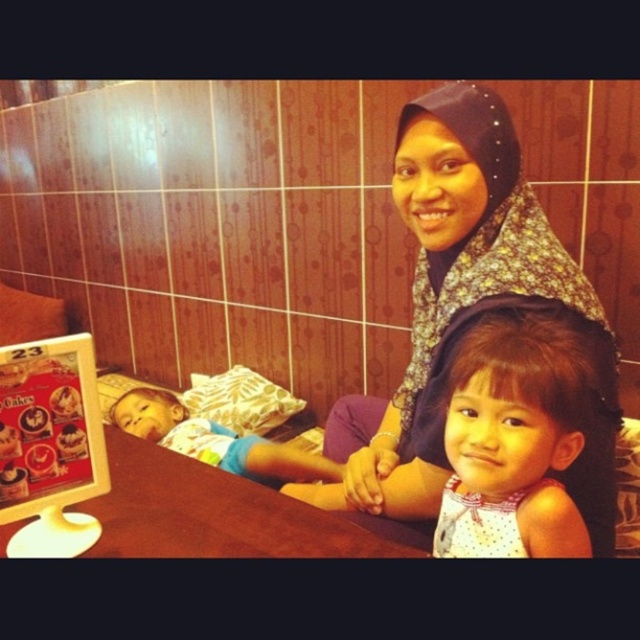
Which is behind, point (483, 195) or point (470, 365)?

The point (483, 195) is more distant.

Which is below, patterned fabric hijab at upper center or light brown hair at center?

light brown hair at center is lower down.

Between point (440, 435) and point (566, 323), which one is positioned in front?

Point (566, 323)

You are a GUI agent. You are given a task and a screenshot of the screen. Output one action in this format:
    pyautogui.click(x=<x>, y=<y>)
    Task: Click on the patterned fabric hijab at upper center
    Image resolution: width=640 pixels, height=640 pixels.
    Given the screenshot: What is the action you would take?
    pyautogui.click(x=467, y=307)

Which is below, light brown hair at center or light blue cotton shirt at left?

light blue cotton shirt at left is lower down.

Does light brown hair at center appear over light blue cotton shirt at left?

Yes, light brown hair at center is above light blue cotton shirt at left.

Which is in front, point (570, 371) or point (243, 445)?

Point (570, 371) is more forward.

In order to click on light brown hair at center in this screenshot , I will do `click(515, 438)`.

Can you confirm if brown wooden table at center is positioned to the left of light blue cotton shirt at left?

In fact, brown wooden table at center is to the right of light blue cotton shirt at left.

What do you see at coordinates (212, 513) in the screenshot? I see `brown wooden table at center` at bounding box center [212, 513].

Is point (124, 552) positioned behind point (266, 472)?

No, (124, 552) is closer to viewer.

Where is `brown wooden table at center`? brown wooden table at center is located at coordinates coord(212,513).